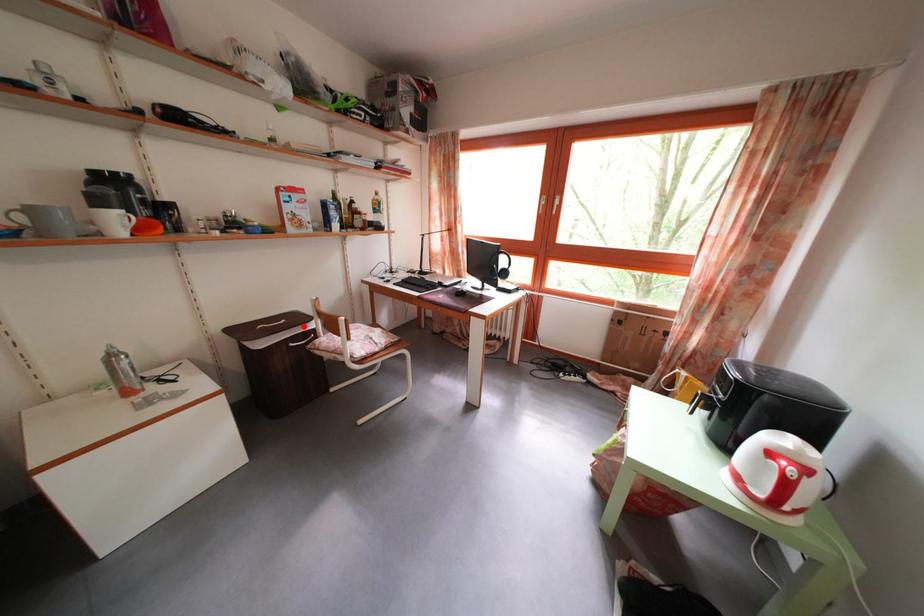
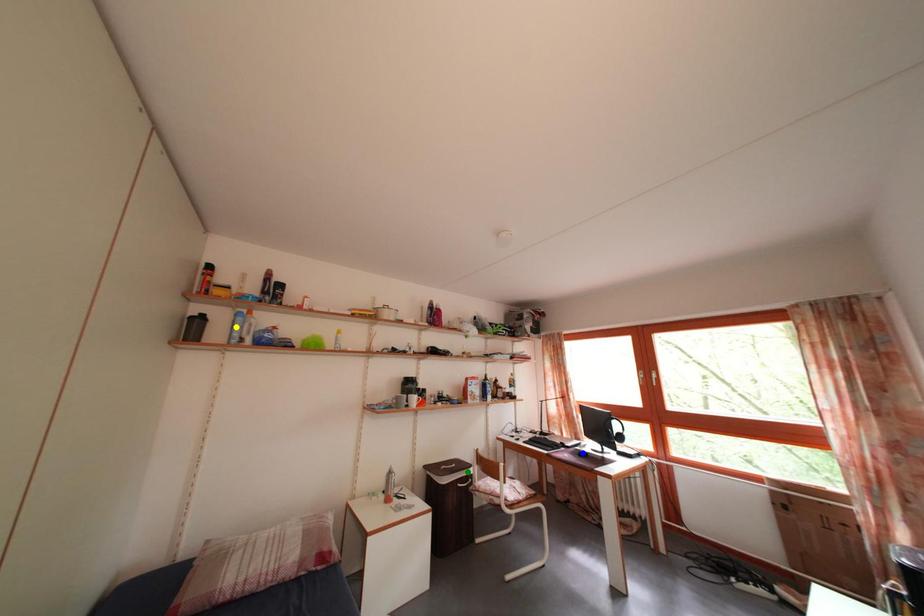
Question: I am providing you with two images of the same scene from different viewpoints. A red point is marked on the first image. You are given multiple points on the second image. Can you choose the point in image 2 that corresponds to the point in image 1?

Choices:
 (A) green point
 (B) blue point
 (C) yellow point

Answer: (A)